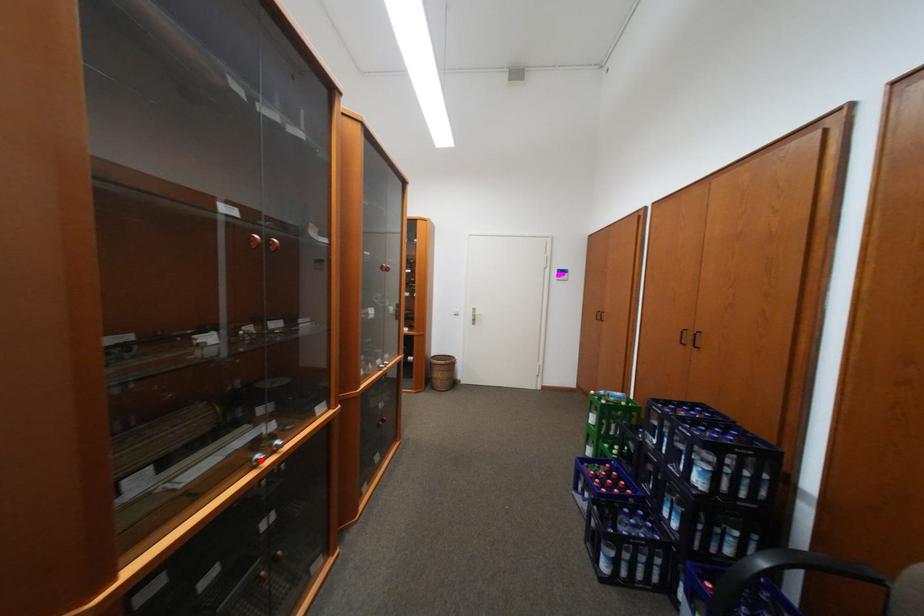
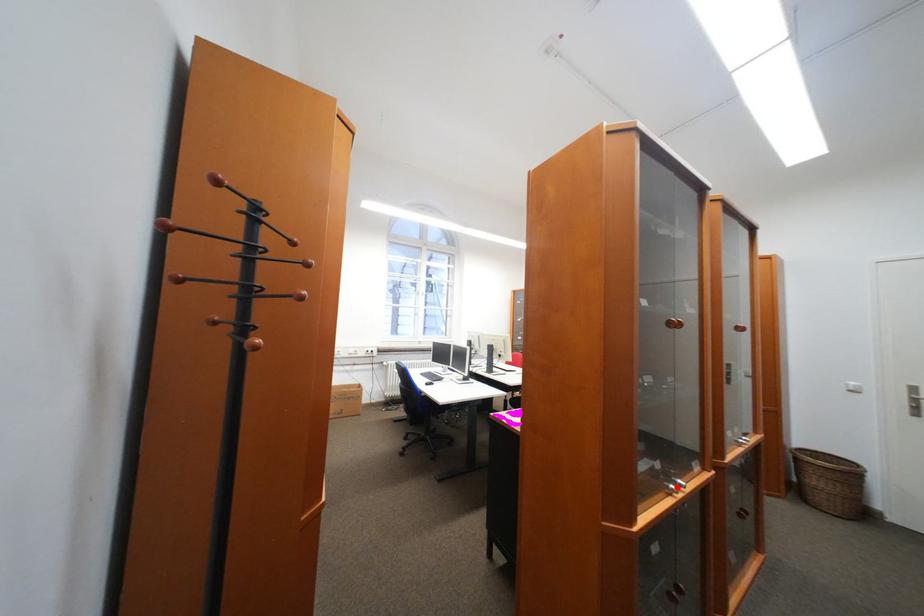
I am providing you with two images of the same scene from different viewpoints. A red point is marked on the first image and another point is marked on the second image. Do the highlighted points in image1 and image2 indicate the same real-world spot?

Yes